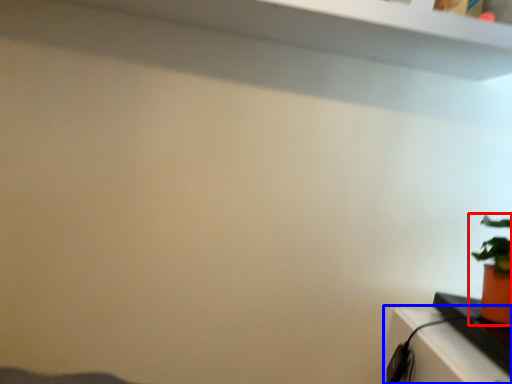
Question: Which object appears farthest to the camera in this image, houseplant (highlighted by a red box) or table (highlighted by a blue box)?

Choices:
 (A) houseplant
 (B) table

Answer: (A)